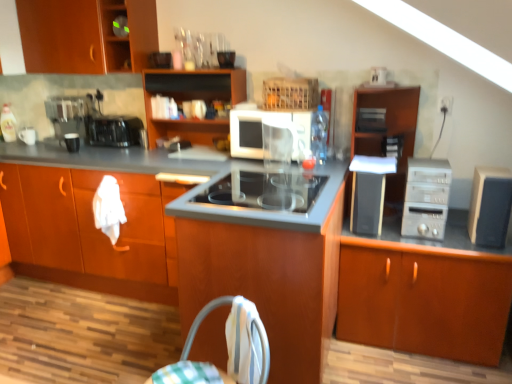
Locate an element on the screen. This screenshot has height=384, width=512. free space behind black matte mug at left, the 4th appliance from the right is located at coordinates (83, 146).